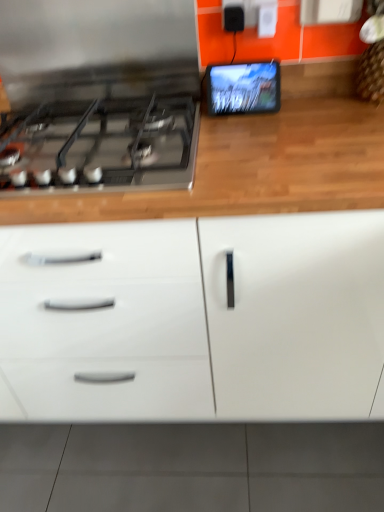
Question: Does white glossy cabinet at center have a lesser width compared to matte black tablet at upper right?

Choices:
 (A) yes
 (B) no

Answer: (B)

Question: Considering the relative positions of white glossy cabinet at center and matte black tablet at upper right in the image provided, is white glossy cabinet at center behind matte black tablet at upper right?

Choices:
 (A) yes
 (B) no

Answer: (B)

Question: Does white glossy cabinet at center lie in front of matte black tablet at upper right?

Choices:
 (A) yes
 (B) no

Answer: (A)

Question: Is white glossy cabinet at center at the right side of matte black tablet at upper right?

Choices:
 (A) no
 (B) yes

Answer: (A)

Question: From the image's perspective, does white glossy cabinet at center appear higher than matte black tablet at upper right?

Choices:
 (A) no
 (B) yes

Answer: (A)

Question: Is white glossy cabinet at center located outside matte black tablet at upper right?

Choices:
 (A) yes
 (B) no

Answer: (A)

Question: From a real-world perspective, is satin black gas stove at left positioned over white glossy cabinet at center based on gravity?

Choices:
 (A) no
 (B) yes

Answer: (B)

Question: From the image's perspective, would you say satin black gas stove at left is shown under white glossy cabinet at center?

Choices:
 (A) yes
 (B) no

Answer: (B)

Question: Does satin black gas stove at left have a lesser width compared to white glossy cabinet at center?

Choices:
 (A) no
 (B) yes

Answer: (B)

Question: Is satin black gas stove at left not close to white glossy cabinet at center?

Choices:
 (A) no
 (B) yes

Answer: (A)

Question: Could you tell me if satin black gas stove at left is turned towards white glossy cabinet at center?

Choices:
 (A) yes
 (B) no

Answer: (A)

Question: Could white glossy cabinet at center be considered to be inside satin black gas stove at left?

Choices:
 (A) yes
 (B) no

Answer: (B)

Question: Could you tell me if white glossy cabinet at center is turned towards satin black gas stove at left?

Choices:
 (A) yes
 (B) no

Answer: (A)